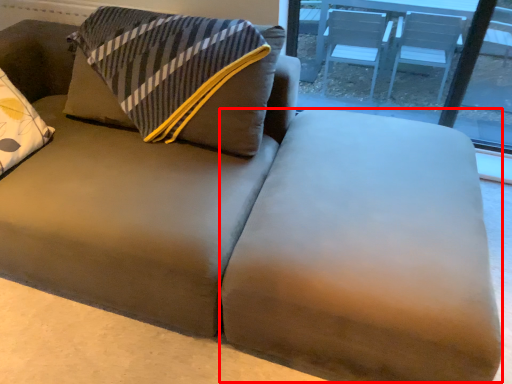
Question: Where is flat (annotated by the red box) located in relation to window in the image?

Choices:
 (A) right
 (B) left

Answer: (B)